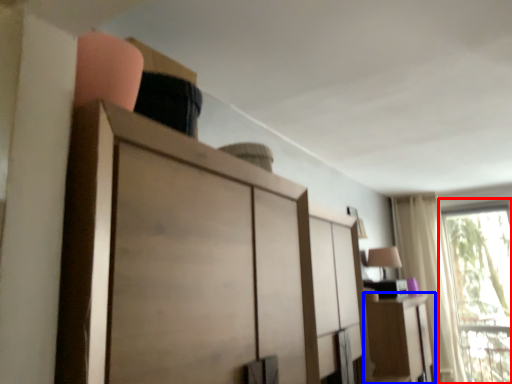
Question: Which object appears farthest to the camera in this image, window (highlighted by a red box) or cabinetry (highlighted by a blue box)?

Choices:
 (A) window
 (B) cabinetry

Answer: (A)